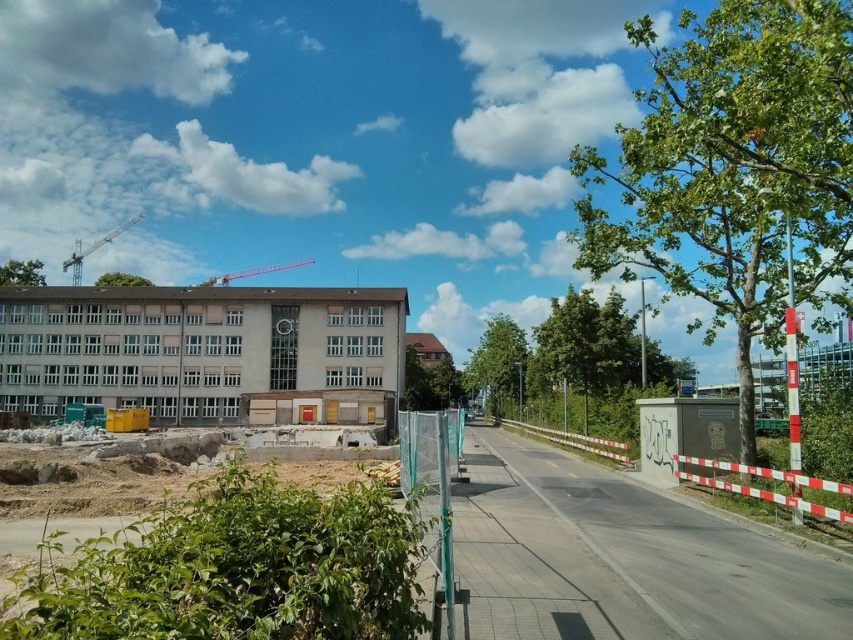
Question: In this image, where is beige concrete building at center located relative to green metallic crane at upper left?

Choices:
 (A) right
 (B) left

Answer: (A)

Question: Estimate the real-world distances between objects in this image. Which object is farther from the green leafy tree at upper left?

Choices:
 (A) white/red striped barrier at right
 (B) green leafy tree at right
 (C) metallic red crane at upper center

Answer: (A)

Question: Which object is farther from the camera taking this photo?

Choices:
 (A) green leafy tree at center
 (B) beige concrete building at center

Answer: (A)

Question: Does green leafy tree at right appear on the left side of white/red striped barrier at right?

Choices:
 (A) no
 (B) yes

Answer: (A)

Question: Which object is closer to the camera taking this photo?

Choices:
 (A) green leafy tree at center
 (B) metallic red crane at upper center
 (C) green metallic crane at upper left

Answer: (A)

Question: Does green leafy tree at right appear under metallic red crane at upper center?

Choices:
 (A) no
 (B) yes

Answer: (A)